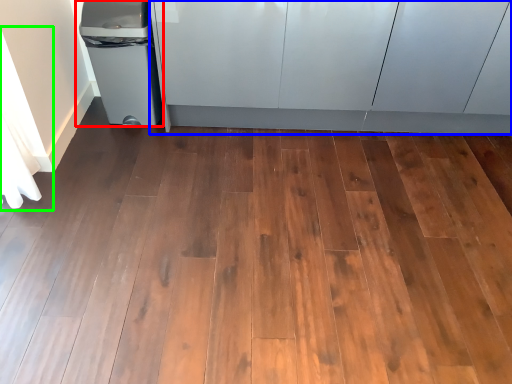
Question: Which object is positioned closest to waste container (highlighted by a red box)? Select from cabinetry (highlighted by a blue box) and curtain (highlighted by a green box).

Choices:
 (A) cabinetry
 (B) curtain

Answer: (B)